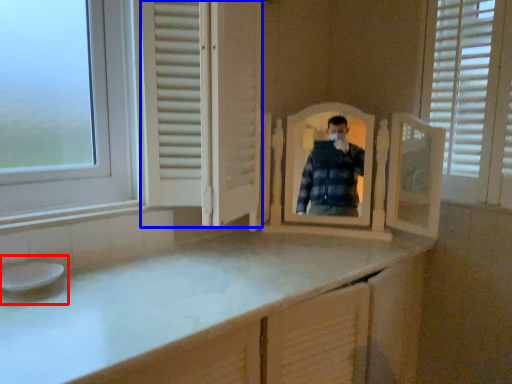
Question: Which object appears farthest to the camera in this image, sink (highlighted by a red box) or screen door (highlighted by a blue box)?

Choices:
 (A) sink
 (B) screen door

Answer: (A)